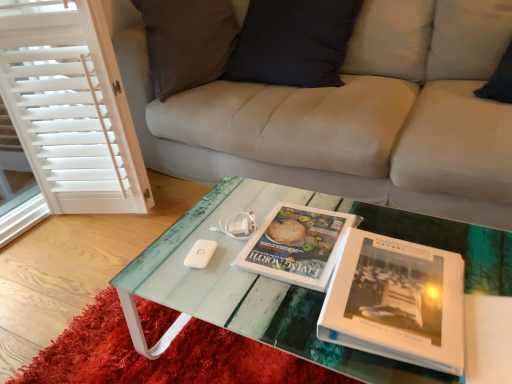
Question: Is translucent glass coffee table at center to the left of translucent glass table at center from the viewer's perspective?

Choices:
 (A) no
 (B) yes

Answer: (A)

Question: Considering the relative sizes of translucent glass coffee table at center and translucent glass table at center in the image provided, is translucent glass coffee table at center thinner than translucent glass table at center?

Choices:
 (A) yes
 (B) no

Answer: (B)

Question: Can you confirm if translucent glass coffee table at center is bigger than translucent glass table at center?

Choices:
 (A) no
 (B) yes

Answer: (B)

Question: Does translucent glass coffee table at center turn towards translucent glass table at center?

Choices:
 (A) yes
 (B) no

Answer: (B)

Question: Is translucent glass table at center completely or partially inside translucent glass coffee table at center?

Choices:
 (A) yes
 (B) no

Answer: (A)

Question: Does translucent glass coffee table at center have a lesser height compared to translucent glass table at center?

Choices:
 (A) yes
 (B) no

Answer: (B)

Question: From the image's perspective, is translucent glass table at center on white wood screen door at left?

Choices:
 (A) yes
 (B) no

Answer: (B)

Question: Is translucent glass table at center at the right side of white wood screen door at left?

Choices:
 (A) no
 (B) yes

Answer: (B)

Question: Is translucent glass table at center located outside white wood screen door at left?

Choices:
 (A) no
 (B) yes

Answer: (B)

Question: Is translucent glass table at center aimed at white wood screen door at left?

Choices:
 (A) yes
 (B) no

Answer: (B)

Question: Does translucent glass table at center have a larger size compared to white wood screen door at left?

Choices:
 (A) no
 (B) yes

Answer: (A)

Question: Does translucent glass table at center have a greater width compared to white wood screen door at left?

Choices:
 (A) yes
 (B) no

Answer: (A)

Question: Does white matte game controller at center have a smaller size compared to translucent glass coffee table at center?

Choices:
 (A) no
 (B) yes

Answer: (B)